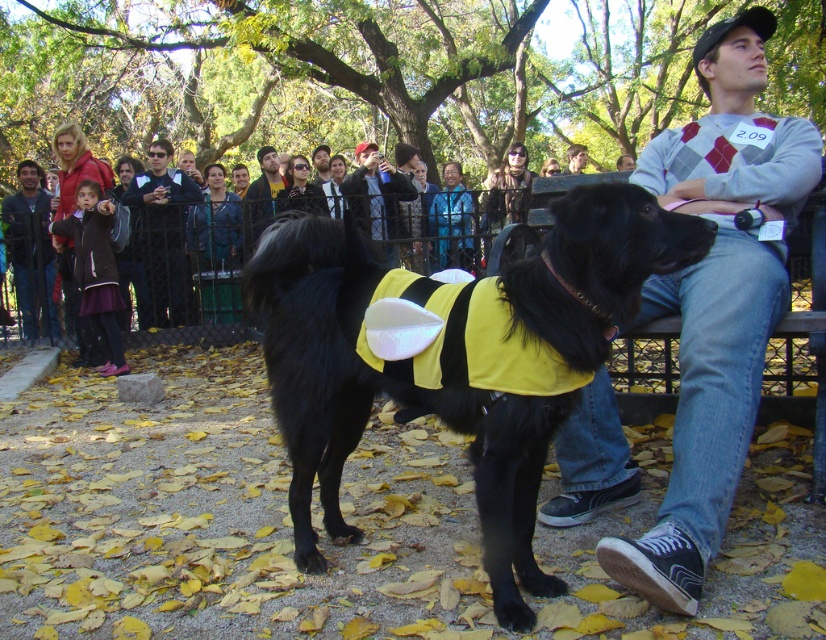
Does dark brown leather jacket at left have a larger size compared to matte black jacket at center?

Indeed, dark brown leather jacket at left has a larger size compared to matte black jacket at center.

Does dark brown leather jacket at left come in front of matte black jacket at center?

Yes, dark brown leather jacket at left is closer to the viewer.

What do you see at coordinates (31, 250) in the screenshot? I see `dark brown leather jacket at left` at bounding box center [31, 250].

At what (x,y) coordinates should I click in order to perform the action: click on dark brown leather jacket at left. Please return your answer as a coordinate pair (x, y). Looking at the image, I should click on (31, 250).

Who is taller, black leather jacket at center or dark brown leather jacket at left?

dark brown leather jacket at left is taller.

Who is more forward, (196, 186) or (40, 202)?

Point (40, 202) is in front.

This screenshot has width=826, height=640. Describe the element at coordinates (164, 230) in the screenshot. I see `black leather jacket at center` at that location.

This screenshot has height=640, width=826. In order to click on black leather jacket at center in this screenshot , I will do `click(164, 230)`.

What do you see at coordinates (392, 397) in the screenshot? I see `yellow fabric dog at center` at bounding box center [392, 397].

Measure the distance between yellow fabric dog at center and camera.

7.00 feet

Identify the location of yellow fabric dog at center. Image resolution: width=826 pixels, height=640 pixels. (392, 397).